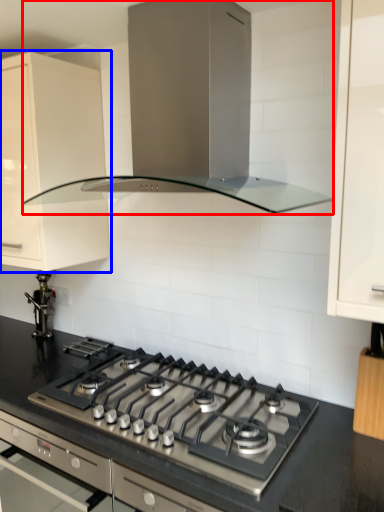
Question: Which of the following is the closest to the observer, home appliance (highlighted by a red box) or cabinetry (highlighted by a blue box)?

Choices:
 (A) home appliance
 (B) cabinetry

Answer: (A)